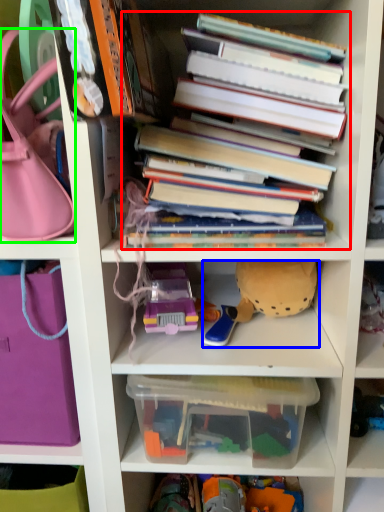
Question: Which is farther away from book (highlighted by a red box)? toy (highlighted by a blue box) or handbag (highlighted by a green box)?

Choices:
 (A) toy
 (B) handbag

Answer: (B)